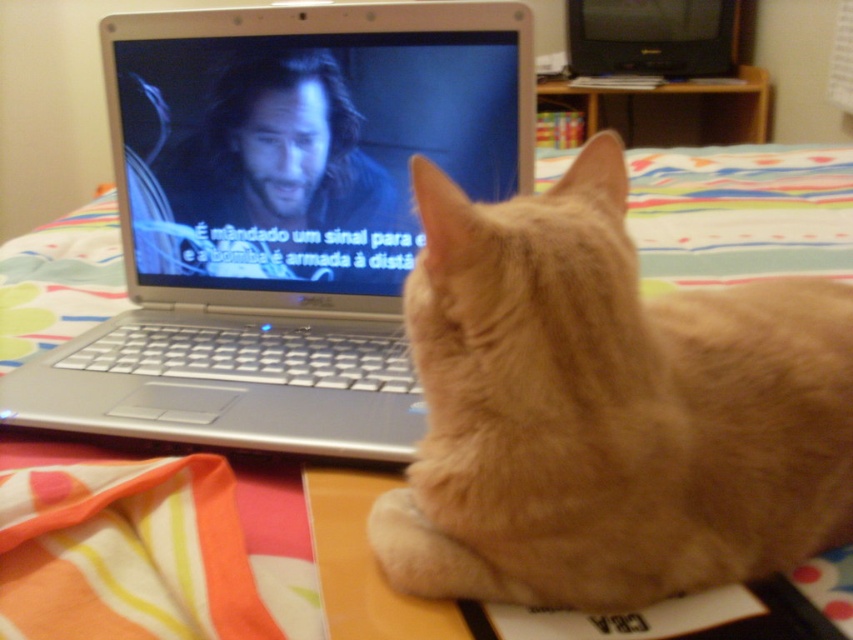
Is silver metallic laptop at center closer to the viewer compared to black plastic television at upper right?

Yes, silver metallic laptop at center is in front of black plastic television at upper right.

In the scene shown: Does silver metallic laptop at center have a lesser height compared to black plastic television at upper right?

Indeed, silver metallic laptop at center has a lesser height compared to black plastic television at upper right.

Who is more distant from viewer, [223,88] or [625,16]?

Positioned behind is point [625,16].

Locate an element on the screen. silver metallic laptop at center is located at coordinates (306, 138).

Who is positioned more to the right, orange fur cat at center or black plastic television at upper right?

black plastic television at upper right

Does orange fur cat at center appear over black plastic television at upper right?

Incorrect, orange fur cat at center is not positioned above black plastic television at upper right.

Who is more distant from viewer, (759, 538) or (579, 68)?

Positioned behind is point (579, 68).

What are the coordinates of `orange fur cat at center` in the screenshot? It's located at (607, 410).

Which is above, orange fur cat at center or silver metallic laptop at center?

silver metallic laptop at center is higher up.

Image resolution: width=853 pixels, height=640 pixels. Identify the location of orange fur cat at center. (607, 410).

Is point (425, 531) in front of point (463, 163)?

Yes, it is.

The width and height of the screenshot is (853, 640). I want to click on orange fur cat at center, so click(607, 410).